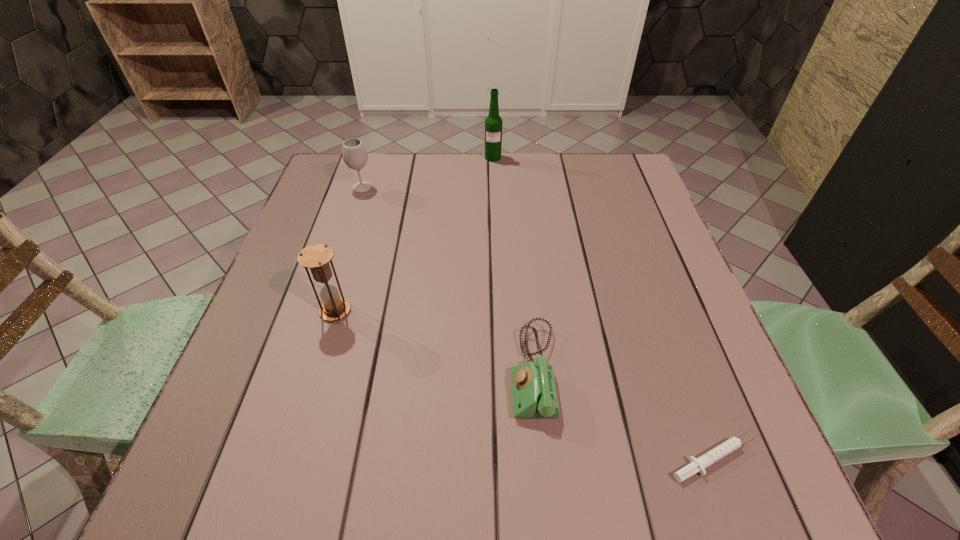
This screenshot has width=960, height=540. What are the coordinates of `free space between the farthest object and the third tallest object` in the screenshot? It's located at (427, 172).

Where is `blank region between the tallest object and the third nearest object`? blank region between the tallest object and the third nearest object is located at coordinates (414, 234).

The width and height of the screenshot is (960, 540). Find the location of `object that ranks as the fourth closest to the beer bottle`. object that ranks as the fourth closest to the beer bottle is located at coordinates (698, 465).

This screenshot has width=960, height=540. What are the coordinates of `object that stands as the closest to the second farthest object` in the screenshot? It's located at (493, 123).

Find the location of a particular element. The height and width of the screenshot is (540, 960). free space in the image that satisfies the following two spatial constraints: 1. on the dial of the fourth farthest object; 2. on the back side of the nearest object is located at coordinates (542, 457).

Find the location of `blank space that satisfies the following two spatial constraints: 1. on the front side of the third farthest object; 2. on the right side of the syringe`. blank space that satisfies the following two spatial constraints: 1. on the front side of the third farthest object; 2. on the right side of the syringe is located at coordinates (292, 457).

What are the coordinates of `free space that satisfies the following two spatial constraints: 1. on the dial of the telephone; 2. on the right side of the syringe` in the screenshot? It's located at (542, 457).